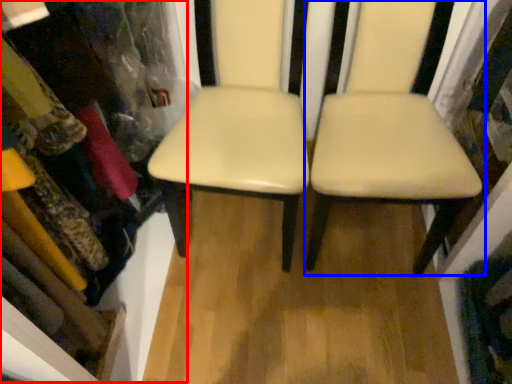
Question: Among these objects, which one is nearest to the camera, bookshelf (highlighted by a red box) or chair (highlighted by a blue box)?

Choices:
 (A) bookshelf
 (B) chair

Answer: (A)